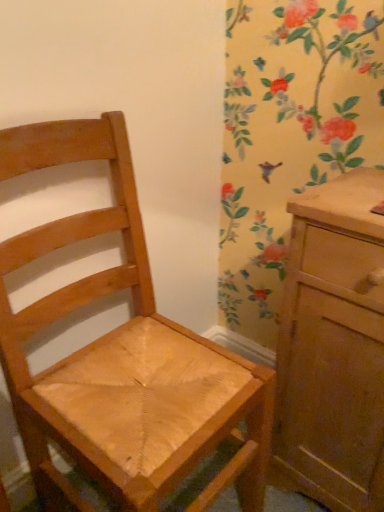
This screenshot has height=512, width=384. What are the coordinates of `wooden chair at center` in the screenshot? It's located at 122,356.

The height and width of the screenshot is (512, 384). What do you see at coordinates (122, 356) in the screenshot? I see `wooden chair at center` at bounding box center [122, 356].

The image size is (384, 512). In order to click on matte wood chest of drawers at right in this screenshot , I will do `click(333, 348)`.

The image size is (384, 512). Describe the element at coordinates (333, 348) in the screenshot. I see `matte wood chest of drawers at right` at that location.

At what (x,y) coordinates should I click in order to perform the action: click on wooden chair at center. Please return your answer as a coordinate pair (x, y). This screenshot has width=384, height=512. Looking at the image, I should click on (122, 356).

In the scene shown: Is wooden chair at center at the right side of matte wood chest of drawers at right?

No, wooden chair at center is not to the right of matte wood chest of drawers at right.

Who is more distant, wooden chair at center or matte wood chest of drawers at right?

matte wood chest of drawers at right is further away from the camera.

Which point is more distant from viewer, (202,404) or (358,322)?

The point (202,404) is more distant.

From the image's perspective, is wooden chair at center under matte wood chest of drawers at right?

No, from the image's perspective, wooden chair at center is not below matte wood chest of drawers at right.

From a real-world perspective, is wooden chair at center on matte wood chest of drawers at right?

Correct, in the physical world, wooden chair at center is higher than matte wood chest of drawers at right.

Considering the relative sizes of wooden chair at center and matte wood chest of drawers at right in the image provided, is wooden chair at center thinner than matte wood chest of drawers at right?

No.

Which of these two, wooden chair at center or matte wood chest of drawers at right, stands taller?

Standing taller between the two is wooden chair at center.

Can you confirm if wooden chair at center is smaller than matte wood chest of drawers at right?

No, wooden chair at center is not smaller than matte wood chest of drawers at right.

Is wooden chair at center spatially inside matte wood chest of drawers at right, or outside of it?

wooden chair at center is not inside matte wood chest of drawers at right, it's outside.

Are wooden chair at center and matte wood chest of drawers at right making contact?

No, wooden chair at center is not touching matte wood chest of drawers at right.

Does wooden chair at center turn towards matte wood chest of drawers at right?

No, wooden chair at center is not turned towards matte wood chest of drawers at right.

How different are the orientations of wooden chair at center and matte wood chest of drawers at right in degrees?

The angular difference between wooden chair at center and matte wood chest of drawers at right is 89.6 degrees.

The image size is (384, 512). Find the location of `chair in front of the matte wood chest of drawers at right`. chair in front of the matte wood chest of drawers at right is located at coordinates (122, 356).

Between matte wood chest of drawers at right and wooden chair at center, which one appears on the left side from the viewer's perspective?

From the viewer's perspective, wooden chair at center appears more on the left side.

Which object is further away from the camera taking this photo, matte wood chest of drawers at right or wooden chair at center?

matte wood chest of drawers at right is further from the camera.

Considering the points (300, 394) and (4, 164), which point is behind, point (300, 394) or point (4, 164)?

The point (300, 394) is farther.

From the image's perspective, is matte wood chest of drawers at right above or below wooden chair at center?

matte wood chest of drawers at right is situated lower than wooden chair at center in the image.

From a real-world perspective, is matte wood chest of drawers at right located higher than wooden chair at center?

No.

Consider the image. Is matte wood chest of drawers at right thinner than wooden chair at center?

Yes.

Between matte wood chest of drawers at right and wooden chair at center, which one has more height?

Standing taller between the two is wooden chair at center.

Who is smaller, matte wood chest of drawers at right or wooden chair at center?

matte wood chest of drawers at right is smaller.

Looking at this image, is matte wood chest of drawers at right positioned beyond the bounds of wooden chair at center?

Indeed, matte wood chest of drawers at right is completely outside wooden chair at center.

Is matte wood chest of drawers at right with wooden chair at center?

No, matte wood chest of drawers at right is not in contact with wooden chair at center.

From the picture: Is matte wood chest of drawers at right aimed at wooden chair at center?

No, matte wood chest of drawers at right is not facing towards wooden chair at center.

Find the location of a particular element. chair on the left of the matte wood chest of drawers at right is located at coordinates (122, 356).

Identify the location of chair above the matte wood chest of drawers at right (from the image's perspective). This screenshot has height=512, width=384. (122, 356).

Find the location of `the chest of drawers behind the wooden chair at center`. the chest of drawers behind the wooden chair at center is located at coordinates (333, 348).